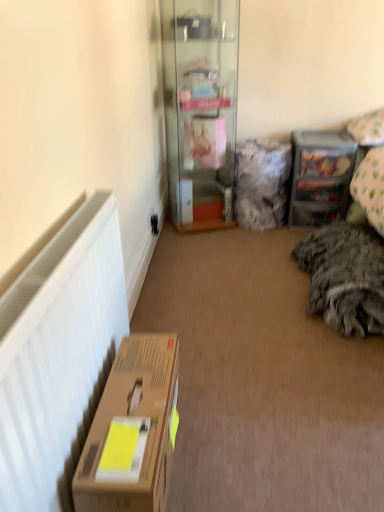
Question: Can you confirm if brown cardboard box at lower left is positioned to the left of clear plastic drawers at upper right?

Choices:
 (A) no
 (B) yes

Answer: (B)

Question: Is brown cardboard box at lower left to the right of clear plastic drawers at upper right from the viewer's perspective?

Choices:
 (A) no
 (B) yes

Answer: (A)

Question: From a real-world perspective, is brown cardboard box at lower left under clear plastic drawers at upper right?

Choices:
 (A) no
 (B) yes

Answer: (B)

Question: Is the position of brown cardboard box at lower left more distant than that of clear plastic drawers at upper right?

Choices:
 (A) yes
 (B) no

Answer: (B)

Question: Is brown cardboard box at lower left completely or partially outside of clear plastic drawers at upper right?

Choices:
 (A) no
 (B) yes

Answer: (B)

Question: From a real-world perspective, relative to white matte radiator at left, is dark gray textured blanket at right vertically above or below?

Choices:
 (A) below
 (B) above

Answer: (B)

Question: In terms of height, does dark gray textured blanket at right look taller or shorter compared to white matte radiator at left?

Choices:
 (A) short
 (B) tall

Answer: (B)

Question: From the image's perspective, is dark gray textured blanket at right above or below white matte radiator at left?

Choices:
 (A) below
 (B) above

Answer: (B)

Question: Visually, is dark gray textured blanket at right positioned to the left or to the right of white matte radiator at left?

Choices:
 (A) right
 (B) left

Answer: (A)

Question: Is clear plastic drawers at upper right in front of or behind white fabric pillow at upper right, the first pillow when ordered from right to left, in the image?

Choices:
 (A) front
 (B) behind

Answer: (B)

Question: Is clear plastic drawers at upper right situated inside white fabric pillow at upper right, the first pillow when ordered from right to left, or outside?

Choices:
 (A) inside
 (B) outside

Answer: (B)

Question: Considering the positions of clear plastic drawers at upper right and white fabric pillow at upper right, acting as the second pillow starting from the left, in the image, is clear plastic drawers at upper right wider or thinner than white fabric pillow at upper right, acting as the second pillow starting from the left,?

Choices:
 (A) wide
 (B) thin

Answer: (B)

Question: Does point (322, 193) appear closer or farther from the camera than point (377, 123)?

Choices:
 (A) farther
 (B) closer

Answer: (A)

Question: Based on their positions, is dark gray textured blanket at right located to the left or right of clear glass cabinet at center?

Choices:
 (A) right
 (B) left

Answer: (A)

Question: Considering the positions of dark gray textured blanket at right and clear glass cabinet at center in the image, is dark gray textured blanket at right wider or thinner than clear glass cabinet at center?

Choices:
 (A) wide
 (B) thin

Answer: (A)